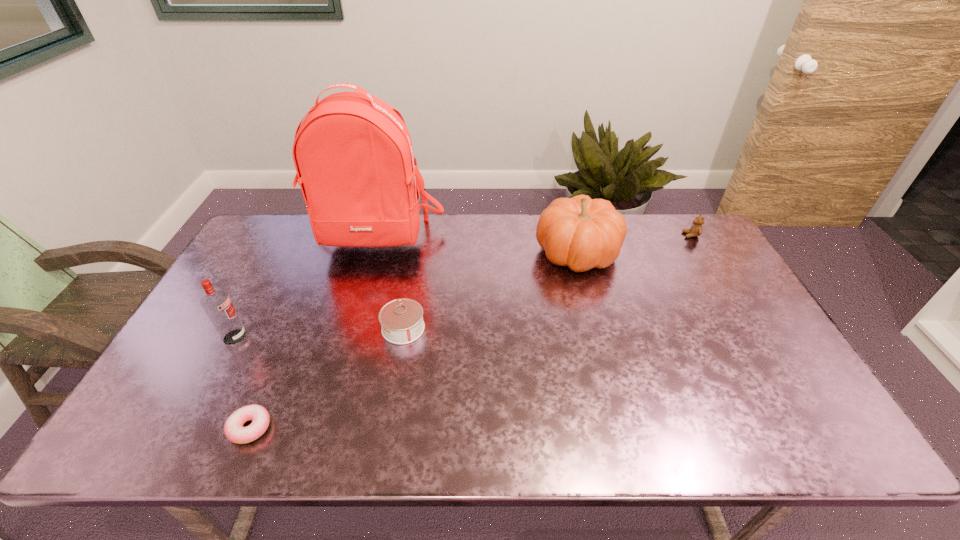
Locate an element on the screen. Image resolution: width=960 pixels, height=540 pixels. free location located on the front label of the leftmost object is located at coordinates (357, 337).

This screenshot has height=540, width=960. Identify the location of free region located on the front-facing side of the third shortest object. (609, 235).

Locate an element on the screen. free space located on the front-facing side of the third shortest object is located at coordinates (594, 235).

Identify the location of free point located on the front-facing side of the third shortest object. The image size is (960, 540). (612, 235).

Locate an element on the screen. Image resolution: width=960 pixels, height=540 pixels. vacant space located 0.160m on the right of the can is located at coordinates (483, 328).

Locate an element on the screen. This screenshot has width=960, height=540. vacant point located 0.220m on the right of the nearest object is located at coordinates (368, 428).

Identify the location of backpack located at the far edge. (353, 154).

Where is `pumpkin at the far edge`? pumpkin at the far edge is located at coordinates (582, 233).

Locate an element on the screen. teddy bear that is at the far edge is located at coordinates (696, 229).

At what (x,y) coordinates should I click in order to perform the action: click on object positioned at the near edge. Please return your answer as a coordinate pair (x, y). This screenshot has width=960, height=540. Looking at the image, I should click on (233, 428).